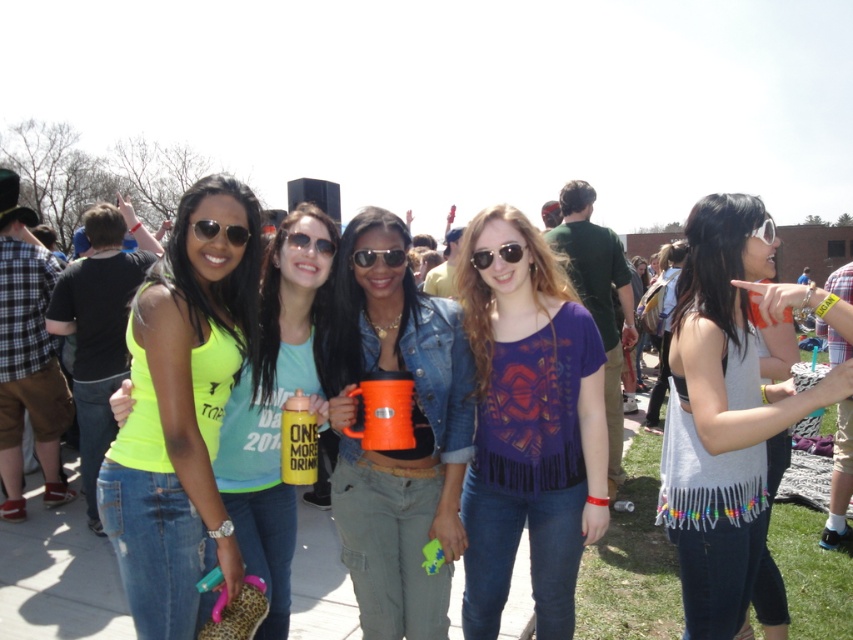
Question: Which point is closer to the camera?

Choices:
 (A) (538, 376)
 (B) (199, 240)
 (C) (386, 296)
 (D) (505, 256)

Answer: (B)

Question: Is purple fringed shirt at center positioned in front of white fringe tank top at right?

Choices:
 (A) no
 (B) yes

Answer: (B)

Question: Can you confirm if black plastic sunglasses at center is positioned to the left of matte plastic sunglasses at center?

Choices:
 (A) yes
 (B) no

Answer: (B)

Question: Which of the following is the farthest from the observer?

Choices:
 (A) (320, 248)
 (B) (364, 257)
 (C) (654, 289)

Answer: (C)

Question: Is matte black sunglasses at upper center further to the viewer compared to white plastic goggles at upper right?

Choices:
 (A) no
 (B) yes

Answer: (A)

Question: Which of the following is the farthest from the observer?

Choices:
 (A) neon yellow tank top at center
 (B) black plastic sunglasses at center

Answer: (B)